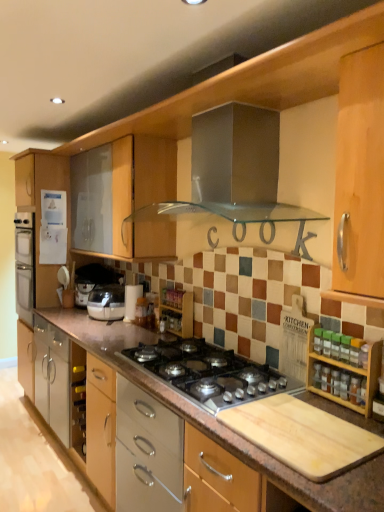
Question: Considering the relative positions of wooden spice rack at center and white paper towel holder at center, positioned as the 1th appliance in front-to-back order, in the image provided, is wooden spice rack at center to the right of white paper towel holder at center, positioned as the 1th appliance in front-to-back order, from the viewer's perspective?

Choices:
 (A) no
 (B) yes

Answer: (B)

Question: Is wooden spice rack at center oriented towards white paper towel holder at center, which is the third appliance from back to front?

Choices:
 (A) no
 (B) yes

Answer: (A)

Question: Is wooden spice rack at center far from white paper towel holder at center, positioned as the 1th appliance in front-to-back order?

Choices:
 (A) yes
 (B) no

Answer: (B)

Question: Is wooden spice rack at center further to the viewer compared to white paper towel holder at center, marked as the 3th appliance in a top-to-bottom arrangement?

Choices:
 (A) no
 (B) yes

Answer: (A)

Question: Does wooden spice rack at center appear on the left side of white paper towel holder at center, positioned as the 1th appliance in front-to-back order?

Choices:
 (A) no
 (B) yes

Answer: (A)

Question: Considering the positions of matte silver cabinet at lower center, the second cabinetry viewed from the right, and wooden spice rack at center in the image, is matte silver cabinet at lower center, the second cabinetry viewed from the right, wider or thinner than wooden spice rack at center?

Choices:
 (A) thin
 (B) wide

Answer: (B)

Question: Considering the positions of matte silver cabinet at lower center, arranged as the second cabinetry when viewed from the top, and wooden spice rack at center in the image, is matte silver cabinet at lower center, arranged as the second cabinetry when viewed from the top, taller or shorter than wooden spice rack at center?

Choices:
 (A) tall
 (B) short

Answer: (B)

Question: Based on their positions, is matte silver cabinet at lower center, the 2th cabinetry when ordered from front to back, located to the left or right of wooden spice rack at center?

Choices:
 (A) right
 (B) left

Answer: (B)

Question: Considering the positions of matte silver cabinet at lower center, arranged as the 1th cabinetry when ordered from the bottom, and wooden spice rack at center in the image, is matte silver cabinet at lower center, arranged as the 1th cabinetry when ordered from the bottom, bigger or smaller than wooden spice rack at center?

Choices:
 (A) small
 (B) big

Answer: (B)

Question: Is white paper towel holder at center, which is the third appliance from back to front, wider or thinner than wooden spice rack at right, positioned as the second cabinetry in left-to-right order?

Choices:
 (A) wide
 (B) thin

Answer: (A)

Question: Considering the relative positions of white paper towel holder at center, positioned as the 1th appliance in front-to-back order, and wooden spice rack at right, the 1th cabinetry when ordered from top to bottom, in the image provided, is white paper towel holder at center, positioned as the 1th appliance in front-to-back order, to the left or to the right of wooden spice rack at right, the 1th cabinetry when ordered from top to bottom,?

Choices:
 (A) right
 (B) left

Answer: (B)

Question: From a real-world perspective, is white paper towel holder at center, acting as the 1th appliance starting from the bottom, above or below wooden spice rack at right, which is counted as the 2th cabinetry, starting from the back?

Choices:
 (A) above
 (B) below

Answer: (A)

Question: Relative to wooden spice rack at right, which is counted as the 2th cabinetry, starting from the back, is white paper towel holder at center, acting as the 3th appliance starting from the left, in front or behind?

Choices:
 (A) front
 (B) behind

Answer: (B)

Question: From the image's perspective, relative to satin silver toaster at lower left, placed as the second appliance when sorted from back to front, is matte white blender at center above or below?

Choices:
 (A) below
 (B) above

Answer: (A)

Question: Relative to satin silver toaster at lower left, which is counted as the second appliance, starting from the right, is matte white blender at center in front or behind?

Choices:
 (A) behind
 (B) front

Answer: (B)